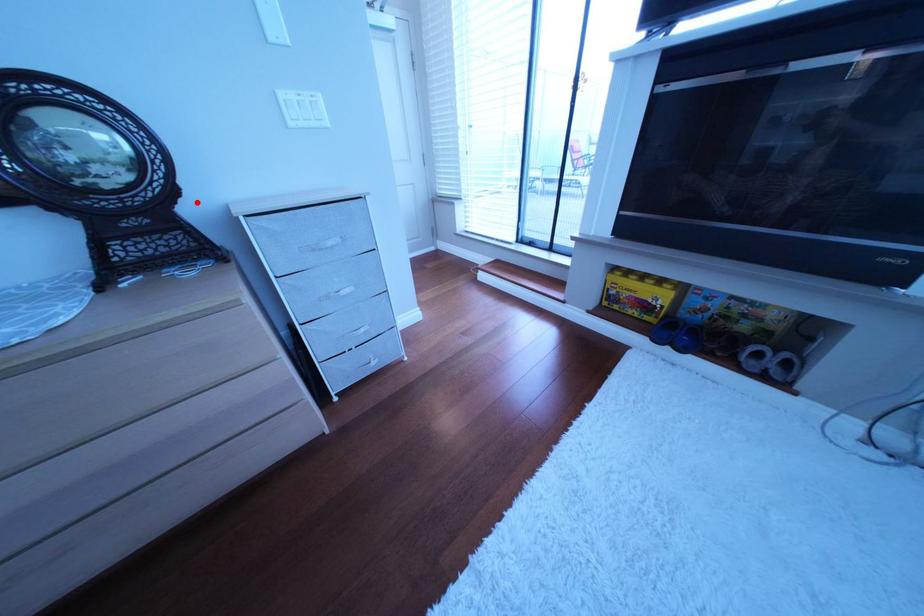
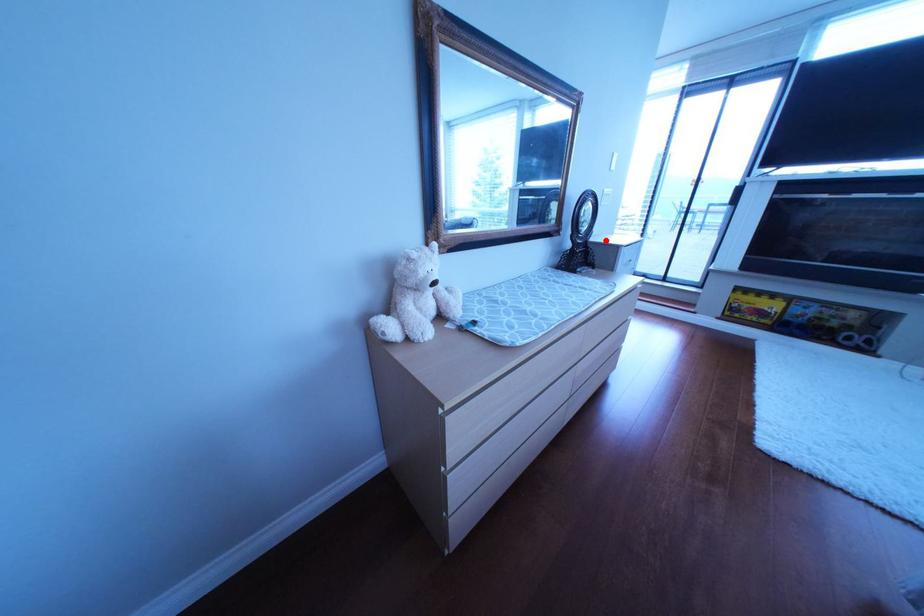
I am providing you with two images of the same scene from different viewpoints. A red point is marked on the first image and another point is marked on the second image. Do the highlighted points in image1 and image2 indicate the same real-world spot?

Yes